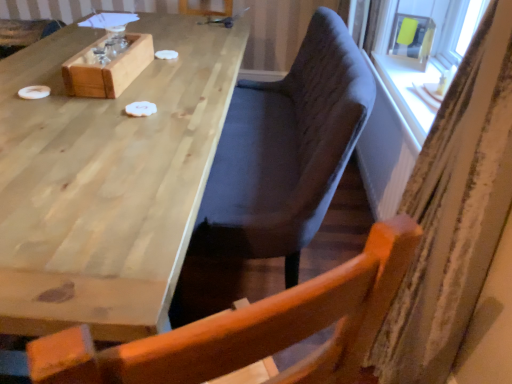
Locate an element on the screen. The width and height of the screenshot is (512, 384). free point above natural wood table at upper left (from a real-world perspective) is located at coordinates (118, 93).